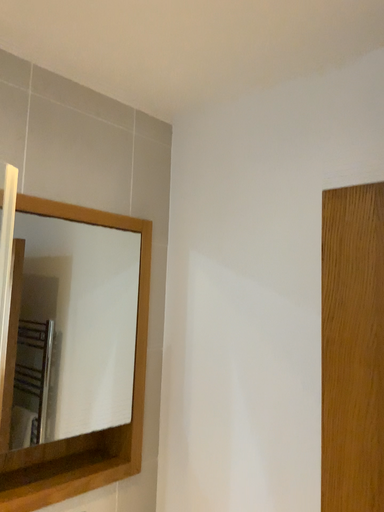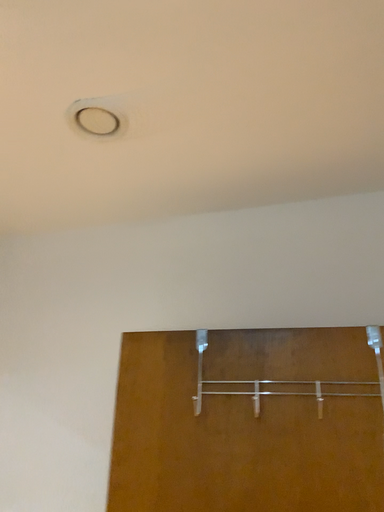
Question: Which way did the camera rotate in the video?

Choices:
 (A) rotated downward
 (B) rotated upward

Answer: (B)